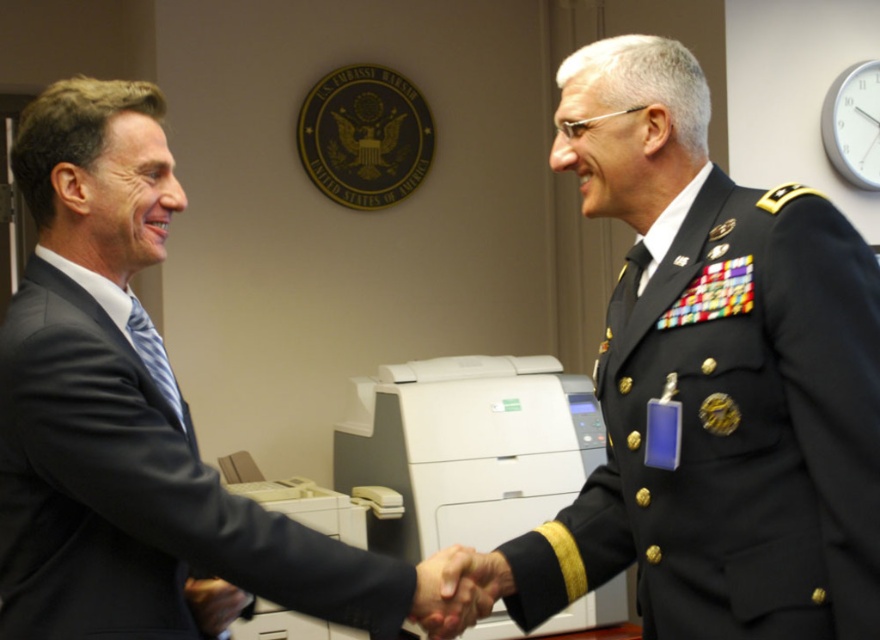
You are a photographer standing in front of the U.S. Embassy Warsaw emblem. You need to take a photo of the black military uniform at right and the white plastic printer at center. Which object should you adjust your focus on first to ensure both are in the frame?

The black military uniform at right is closer to the viewer than the white plastic printer at center, so adjust focus on the black military uniform at right first to ensure both are in the frame.

You are standing in the U.S. Embassy Warsaw office where the handshake is happening. You need to pick up a document from the printer located at point (x=444, y=589). If you are currently 4.38 feet away from that point, can you reach it without moving closer?

The point (x=444, y=589) is 4.38 feet away from you. Since the average human arm length is about 2.5 feet, you cannot reach the document at point 0.923, 0.923 without moving closer.

You are an event planner trying to arrange seating for a ceremony. You have two chairs available. One chair is designed for someone wearing the black military uniform at right, and the other for the dark blue wool suit at center. Which chair needs to be wider to accommodate the clothing properly?

The chair for the dark blue wool suit at center needs to be wider because the black military uniform at right is thinner than the dark blue wool suit at center, so the wider chair should accommodate the larger suit.